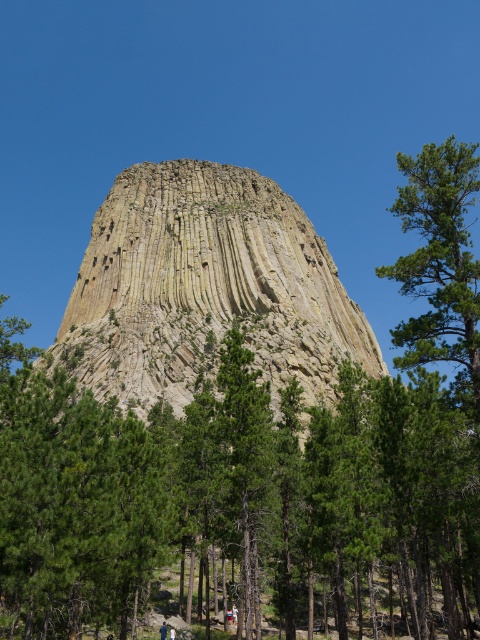
Question: Which of these objects is positioned farthest from the green leafy tree at center?

Choices:
 (A) yellowish rock formation at center
 (B) light brown wooden stick at lower center
 (C) green textured tree at right

Answer: (A)

Question: Observing the image, what is the correct spatial positioning of green textured tree at right in reference to light brown wooden stick at lower center?

Choices:
 (A) above
 (B) below

Answer: (A)

Question: Is yellowish rock formation at center smaller than light brown wooden stick at lower center?

Choices:
 (A) no
 (B) yes

Answer: (A)

Question: Among these objects, which one is nearest to the camera?

Choices:
 (A) green textured tree at right
 (B) light brown wooden stick at lower center
 (C) yellowish rock formation at center

Answer: (A)

Question: Which of the following is the farthest from the observer?

Choices:
 (A) (116, 221)
 (B) (437, 177)

Answer: (A)

Question: Is green leafy tree at center to the right of yellowish rock formation at center from the viewer's perspective?

Choices:
 (A) no
 (B) yes

Answer: (B)